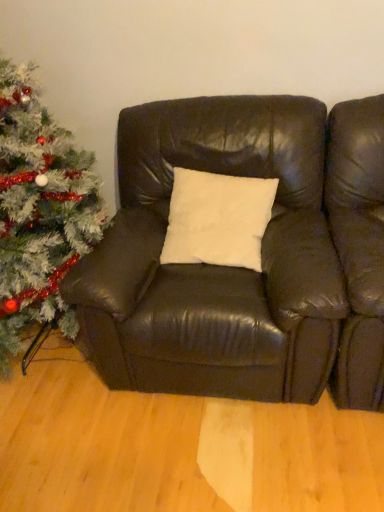
This screenshot has width=384, height=512. Find the location of `white glittery christmas tree at left`. white glittery christmas tree at left is located at coordinates (40, 211).

The width and height of the screenshot is (384, 512). Describe the element at coordinates (40, 211) in the screenshot. I see `white glittery christmas tree at left` at that location.

This screenshot has height=512, width=384. What do you see at coordinates (243, 269) in the screenshot?
I see `matte brown leather couch at center` at bounding box center [243, 269].

Where is `matte brown leather couch at center`? The image size is (384, 512). matte brown leather couch at center is located at coordinates (243, 269).

Where is `white glittery christmas tree at left`? The width and height of the screenshot is (384, 512). white glittery christmas tree at left is located at coordinates (40, 211).

Between matte brown leather couch at center and white glittery christmas tree at left, which one appears on the left side from the viewer's perspective?

white glittery christmas tree at left is more to the left.

From the picture: Which object is closer to the camera taking this photo, matte brown leather couch at center or white glittery christmas tree at left?

white glittery christmas tree at left is in front.

Is point (379, 286) in front of point (22, 228)?

Yes, point (379, 286) is closer to viewer.

From the image's perspective, relative to white glittery christmas tree at left, is matte brown leather couch at center above or below?

Clearly, from the image's perspective, matte brown leather couch at center is below white glittery christmas tree at left.

From a real-world perspective, does matte brown leather couch at center stand above white glittery christmas tree at left?

No, from a real-world perspective, matte brown leather couch at center is not above white glittery christmas tree at left.

Between matte brown leather couch at center and white glittery christmas tree at left, which one has larger width?

With larger width is matte brown leather couch at center.

From their relative heights in the image, would you say matte brown leather couch at center is taller or shorter than white glittery christmas tree at left?

Considering their sizes, matte brown leather couch at center has less height than white glittery christmas tree at left.

Looking at the image, does matte brown leather couch at center seem bigger or smaller compared to white glittery christmas tree at left?

In the image, matte brown leather couch at center appears to be smaller than white glittery christmas tree at left.

Is matte brown leather couch at center inside the boundaries of white glittery christmas tree at left, or outside?

matte brown leather couch at center is not enclosed by white glittery christmas tree at left.

Is matte brown leather couch at center placed right next to white glittery christmas tree at left?

matte brown leather couch at center and white glittery christmas tree at left are not in contact.

Is matte brown leather couch at center looking in the opposite direction of white glittery christmas tree at left?

No, matte brown leather couch at center is not facing away from white glittery christmas tree at left.

Find the location of a particular element. The image size is (384, 512). studio couch below the white glittery christmas tree at left (from the image's perspective) is located at coordinates pyautogui.click(x=243, y=269).

In the image, is white glittery christmas tree at left on the left side or the right side of matte brown leather couch at center?

Based on their positions, white glittery christmas tree at left is located to the left of matte brown leather couch at center.

Relative to matte brown leather couch at center, is white glittery christmas tree at left in front or behind?

white glittery christmas tree at left is positioned closer to the viewer than matte brown leather couch at center.

Which is farther from the camera, (55,194) or (380,166)?

Point (55,194)

From the image's perspective, would you say white glittery christmas tree at left is shown under matte brown leather couch at center?

No, from the image's perspective, white glittery christmas tree at left is not below matte brown leather couch at center.

From a real-world perspective, is white glittery christmas tree at left located beneath matte brown leather couch at center?

No, from a real-world perspective, white glittery christmas tree at left is not below matte brown leather couch at center.

Is white glittery christmas tree at left wider or thinner than matte brown leather couch at center?

white glittery christmas tree at left is thinner than matte brown leather couch at center.

From their relative heights in the image, would you say white glittery christmas tree at left is taller or shorter than matte brown leather couch at center?

Considering their sizes, white glittery christmas tree at left has more height than matte brown leather couch at center.

Which of these two, white glittery christmas tree at left or matte brown leather couch at center, is bigger?

With larger size is white glittery christmas tree at left.

Is matte brown leather couch at center inside white glittery christmas tree at left?

Actually, matte brown leather couch at center is outside white glittery christmas tree at left.

Is white glittery christmas tree at left directly adjacent to matte brown leather couch at center?

They are not placed beside each other.

Is white glittery christmas tree at left facing towards matte brown leather couch at center?

No, white glittery christmas tree at left is not turned towards matte brown leather couch at center.

Can you tell me how much white glittery christmas tree at left and matte brown leather couch at center differ in facing direction?

They differ by 1.5 degrees in their facing directions.

Find the location of a particular element. studio couch located behind the white glittery christmas tree at left is located at coordinates (243, 269).

The image size is (384, 512). I want to click on christmas tree located on the left of matte brown leather couch at center, so [x=40, y=211].

This screenshot has width=384, height=512. I want to click on studio couch located behind the white glittery christmas tree at left, so (243, 269).